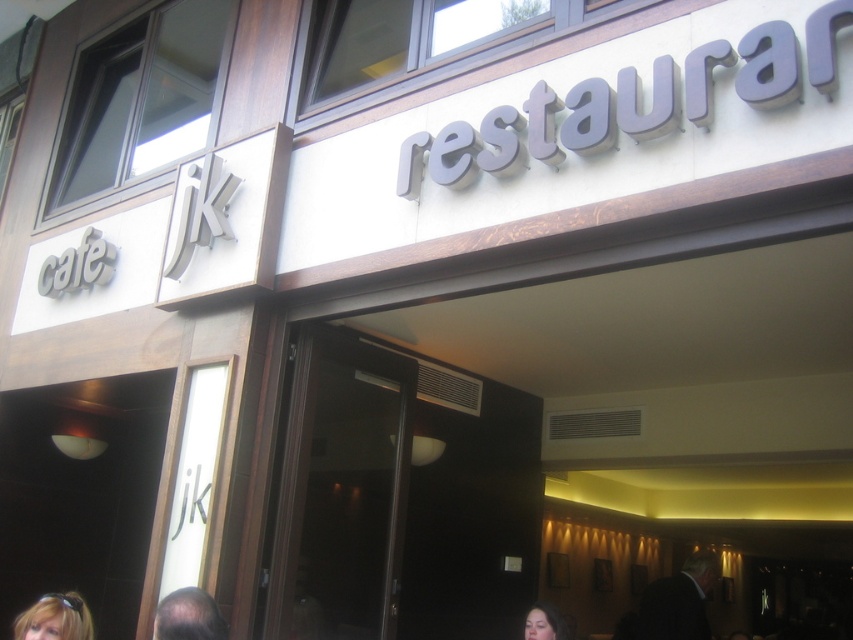
Question: Is blonde hair at lower left smaller than smooth skin face at lower center?

Choices:
 (A) yes
 (B) no

Answer: (B)

Question: Is blonde hair at lower left further to the viewer compared to smooth skin face at lower center?

Choices:
 (A) yes
 (B) no

Answer: (A)

Question: Can you confirm if blonde hair at lower left is wider than smooth skin face at lower center?

Choices:
 (A) no
 (B) yes

Answer: (B)